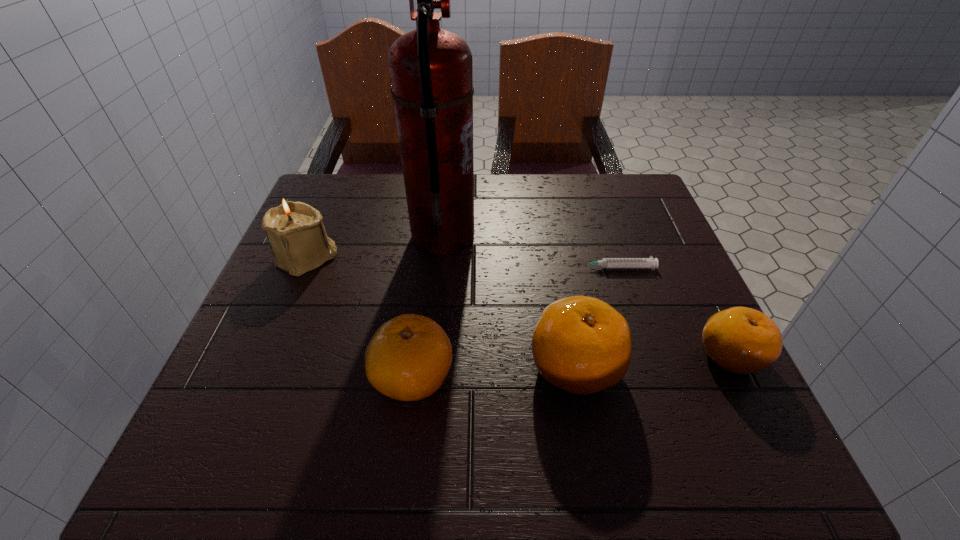
Image resolution: width=960 pixels, height=540 pixels. In order to click on syringe positioned at the right edge in this screenshot , I will do `click(652, 263)`.

Identify the location of object at the near right corner. The height and width of the screenshot is (540, 960). (742, 340).

This screenshot has width=960, height=540. I want to click on vacant region at the far edge of the desktop, so pyautogui.click(x=559, y=204).

Find the location of `free space at the near edge of the desktop`. free space at the near edge of the desktop is located at coordinates (331, 413).

The height and width of the screenshot is (540, 960). I want to click on free region at the left edge of the desktop, so click(x=278, y=272).

The height and width of the screenshot is (540, 960). In order to click on vacant space at the right edge of the desktop in this screenshot , I will do `click(658, 366)`.

Locate an element on the screen. Image resolution: width=960 pixels, height=540 pixels. vacant space at the far left corner is located at coordinates (332, 219).

The image size is (960, 540). In the image, there is a desktop. What are the coordinates of `free space at the near left corner` in the screenshot? It's located at (245, 404).

What are the coordinates of `vacant space at the far right corner of the desktop` in the screenshot? It's located at (632, 191).

Where is `free location at the near right corner`? free location at the near right corner is located at coordinates (737, 411).